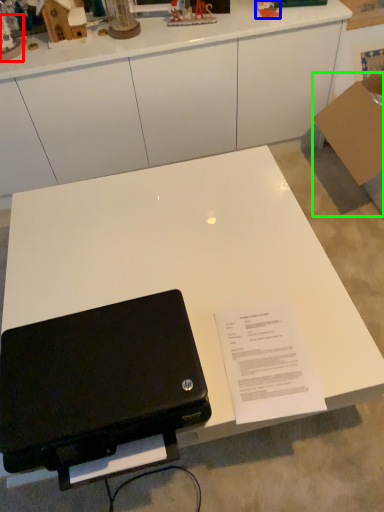
Question: Which object is positioned farthest from toy (highlighted by a red box)? Select from toy (highlighted by a blue box) and cardboard box (highlighted by a green box).

Choices:
 (A) toy
 (B) cardboard box

Answer: (B)